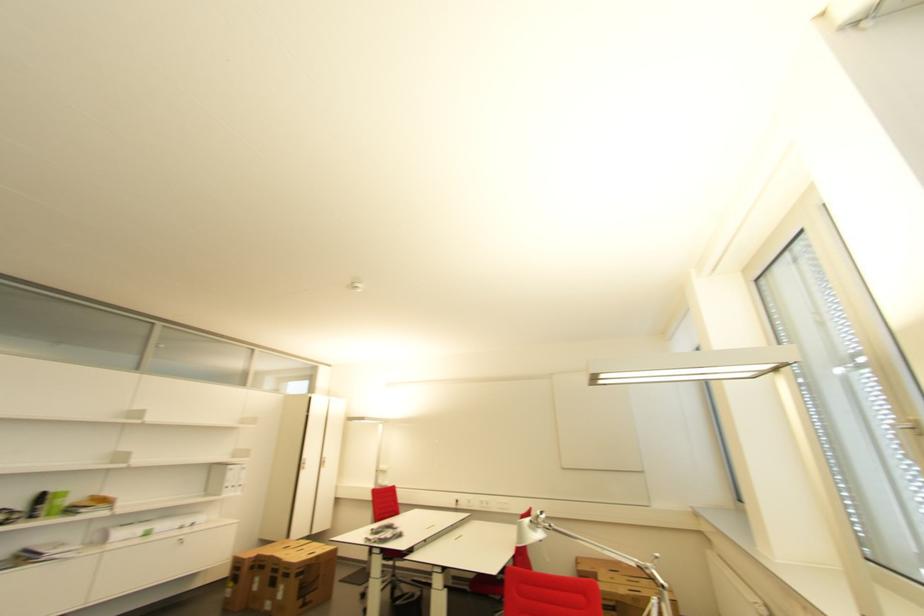
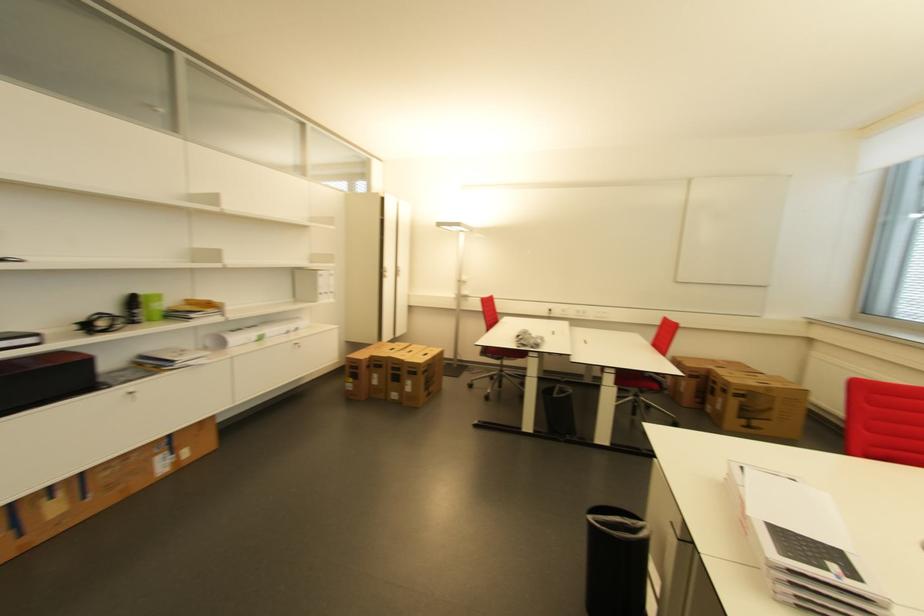
In the second image, find the point that corresponds to [186,541] in the first image.

(300, 345)